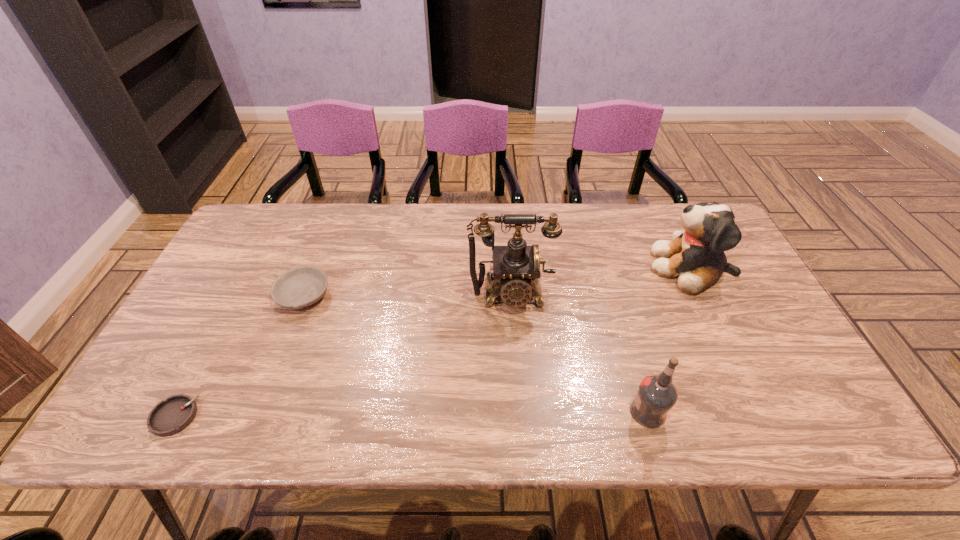
You are a GUI agent. You are given a task and a screenshot of the screen. Output one action in this format:
    pyautogui.click(x=<x>, y=<y>)
    Task: Click on the third object from right to left
    This screenshot has width=960, height=540.
    Given the screenshot: What is the action you would take?
    pyautogui.click(x=516, y=267)

Identify the location of telephone. (516, 267).

Where is `puppy`? The height and width of the screenshot is (540, 960). puppy is located at coordinates click(x=696, y=257).

You are a GUI agent. You are given a task and a screenshot of the screen. Output one action in this format:
    pyautogui.click(x=<x>, y=<y>)
    Task: Click on the vodka
    The width and height of the screenshot is (960, 540).
    Given the screenshot: What is the action you would take?
    pyautogui.click(x=656, y=396)

Locate an element on the screen. the fourth object from right to left is located at coordinates tap(299, 287).

Locate an element on the screen. the second shortest object is located at coordinates (299, 287).

Where is `the shortest object`? the shortest object is located at coordinates (171, 416).

You are a GUI agent. You are given a task and a screenshot of the screen. Output one action in this format:
    pyautogui.click(x=<x>, y=<y>)
    Task: Click on the leftmost object
    
    Given the screenshot: What is the action you would take?
    pyautogui.click(x=171, y=416)

Where is `free region located 0.070m on the rotary dial of the telephone`? This screenshot has height=540, width=960. free region located 0.070m on the rotary dial of the telephone is located at coordinates (514, 338).

Identify the location of vacant space situated 0.250m at the face of the rightmost object. Image resolution: width=960 pixels, height=540 pixels. (564, 267).